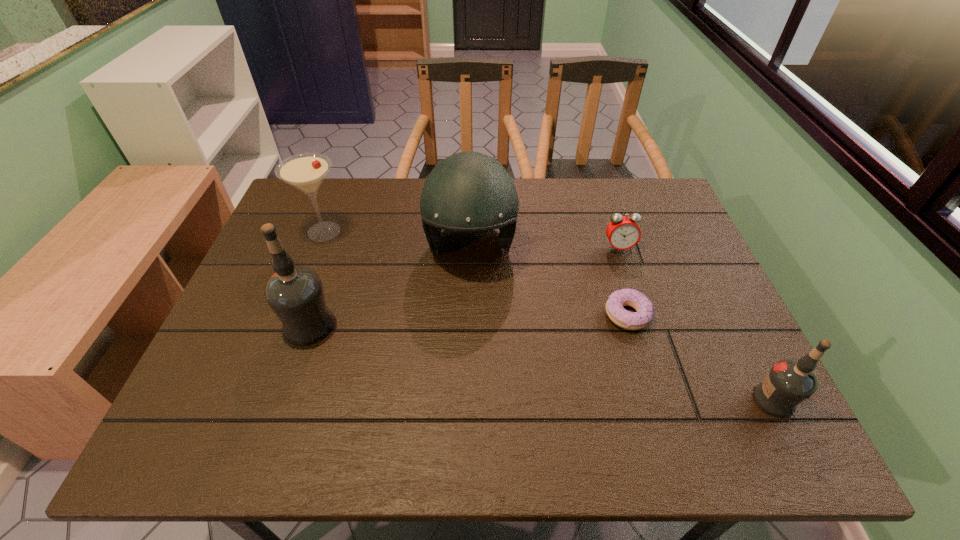
Image resolution: width=960 pixels, height=540 pixels. In order to click on vacant space located 0.130m on the front label of the taller vodka in this screenshot , I will do `click(228, 325)`.

In order to click on free space located on the front label of the nearest object in this screenshot , I will do click(652, 400).

The height and width of the screenshot is (540, 960). In order to click on vacant space located 0.250m on the front label of the nearest object in this screenshot , I will do `click(633, 400)`.

Image resolution: width=960 pixels, height=540 pixels. I want to click on vacant space located on the front label of the nearest object, so click(x=730, y=400).

I want to click on free spot located 0.270m at the face opening of the football helmet, so click(468, 374).

Locate an element on the screen. free location located 0.310m on the front-facing side of the second shortest object is located at coordinates (651, 348).

In order to click on vacant space located on the right of the martini in this screenshot , I will do `click(463, 232)`.

In order to click on free space located 0.320m on the left of the shortest object in this screenshot , I will do `click(471, 315)`.

Image resolution: width=960 pixels, height=540 pixels. Identify the location of football helmet that is at the far edge. (468, 192).

Locate an element on the screen. The image size is (960, 540). martini that is at the far edge is located at coordinates (306, 171).